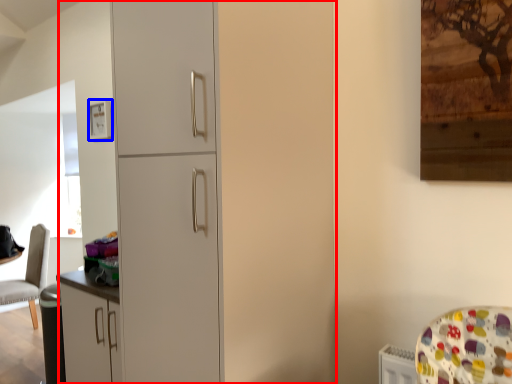
Question: Which point is further to the camera, dresser (highlighted by a red box) or picture frame (highlighted by a blue box)?

Choices:
 (A) dresser
 (B) picture frame

Answer: (B)